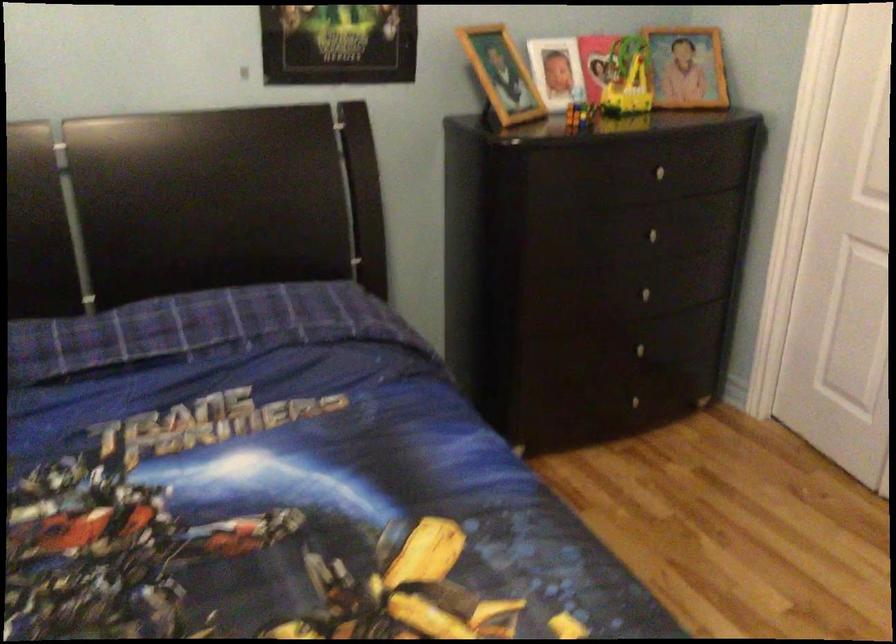
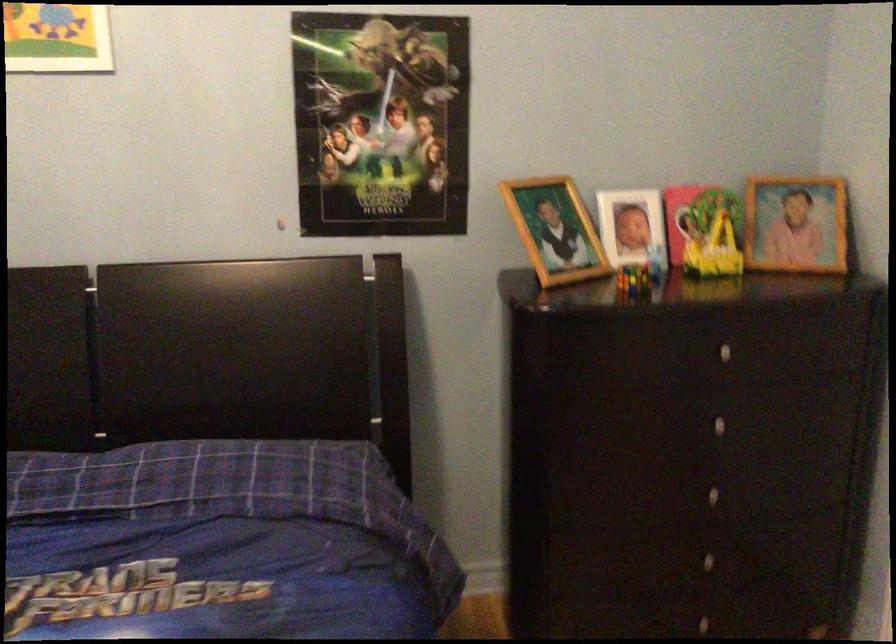
The point at (583, 114) is marked in the first image. Where is the corresponding point in the second image?

(634, 279)